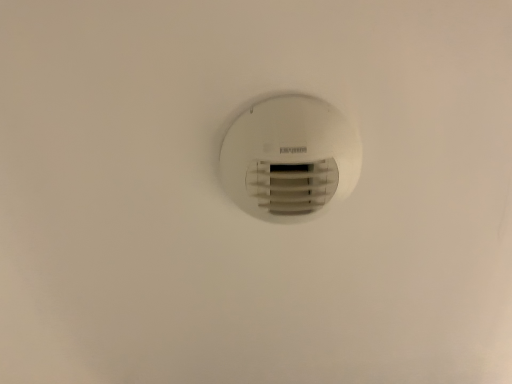
You are a GUI agent. You are given a task and a screenshot of the screen. Output one action in this format:
    pyautogui.click(x=<x>, y=<y>)
    Task: Click on the white plastic vent at center
    This screenshot has width=512, height=384.
    Given the screenshot: What is the action you would take?
    pyautogui.click(x=290, y=159)

What do you see at coordinates (290, 159) in the screenshot? I see `white plastic vent at center` at bounding box center [290, 159].

Find the location of a particular element. The height and width of the screenshot is (384, 512). white plastic vent at center is located at coordinates (290, 159).